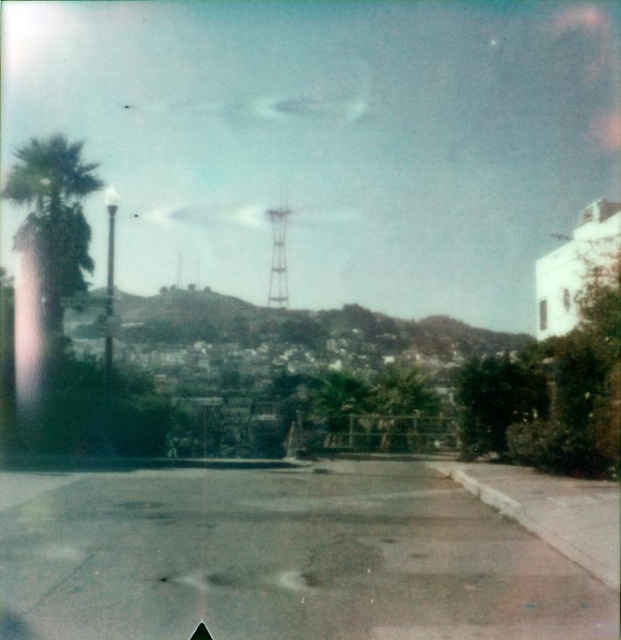
You are a drone operator tasked with capturing aerial footage of the palm tree in the image. The drone must fly from the center of the image towards the green leafy palm tree at left. What direction should the drone move in to reach the palm tree?

The green leafy palm tree at left is located at coordinates point (53, 216), so the drone should move towards the left and slightly upwards from the center to reach it.

You are a drone operator trying to fly a drone from the green leafy palm tree at left to the metallic water tower at center. Considering their heights, will the drone need to ascend or descend to reach the destination?

The green leafy palm tree at left is much taller as metallic water tower at center, so the drone will need to descend to reach the metallic water tower at center.